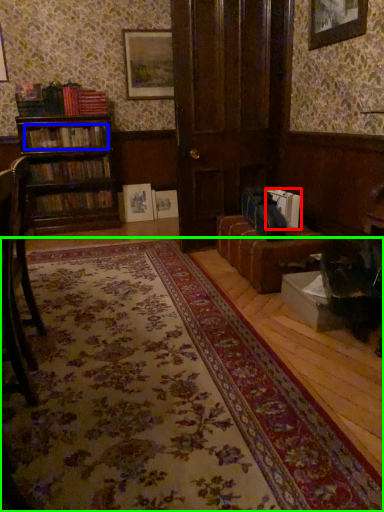
Question: Which object is the closest to the book (highlighted by a red box)? Choose among these: book (highlighted by a blue box) or mat (highlighted by a green box).

Choices:
 (A) book
 (B) mat

Answer: (B)